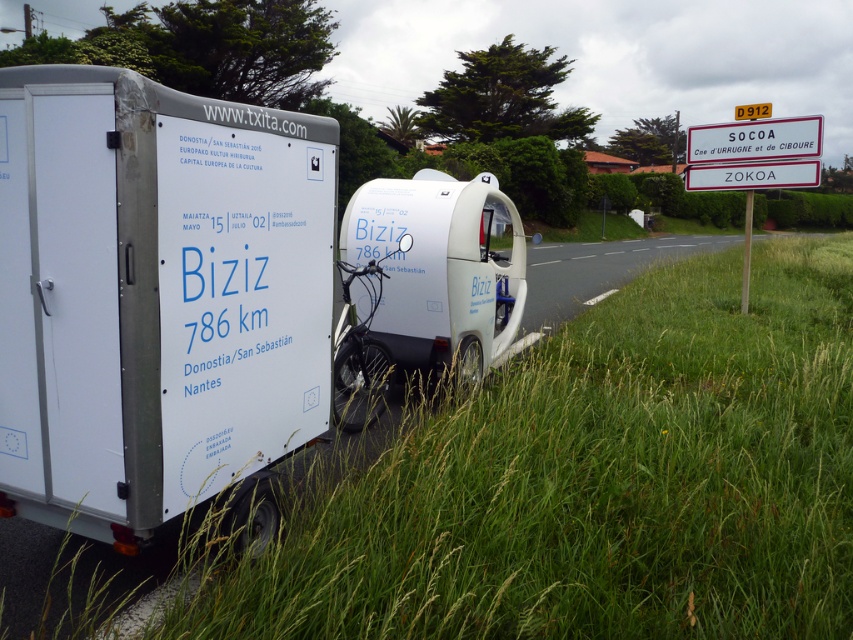
What do you see at coordinates (155, 294) in the screenshot?
I see `white matte trailer at left` at bounding box center [155, 294].

Is white matte trailer at left to the right of white plastic sign at upper right from the viewer's perspective?

Incorrect, white matte trailer at left is not on the right side of white plastic sign at upper right.

Who is more distant from viewer, (123, 310) or (750, 176)?

The point (750, 176) is more distant.

Where is `white matte trailer at left`? The image size is (853, 640). white matte trailer at left is located at coordinates (155, 294).

The height and width of the screenshot is (640, 853). In order to click on green grass at lower right in this screenshot , I will do `click(592, 481)`.

Who is higher up, green grass at lower right or white plastic sign at upper right?

Positioned higher is white plastic sign at upper right.

Locate an element on the screen. green grass at lower right is located at coordinates (592, 481).

Measure the distance between point (546, 595) and camera.

Point (546, 595) and camera are 2.71 meters apart from each other.

Between green grass at lower right and metallic bicycle at center, which one is positioned lower?

Positioned lower is green grass at lower right.

This screenshot has width=853, height=640. Describe the element at coordinates (592, 481) in the screenshot. I see `green grass at lower right` at that location.

Find the location of `green grass at lower right`. green grass at lower right is located at coordinates (x=592, y=481).